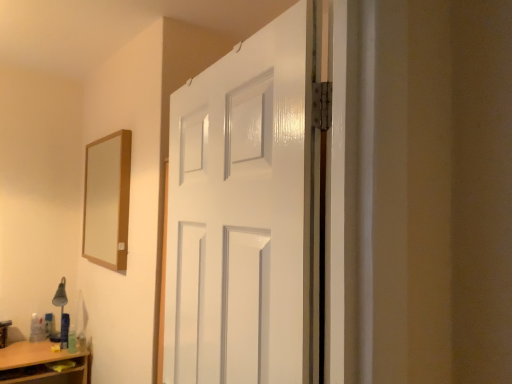
Question: Considering the positions of point (273, 163) and point (101, 256), is point (273, 163) closer or farther from the camera than point (101, 256)?

Choices:
 (A) closer
 (B) farther

Answer: (A)

Question: Which is correct: white glossy door at center is inside wooden-framed mirror at upper left, or outside of it?

Choices:
 (A) inside
 (B) outside

Answer: (B)

Question: Estimate the real-world distances between objects in this image. Which object is farther from the white glossy door at center?

Choices:
 (A) matte silver table lamp at lower left
 (B) wooden-framed mirror at upper left

Answer: (A)

Question: Which of these objects is positioned closest to the white glossy door at center?

Choices:
 (A) wooden-framed mirror at upper left
 (B) matte silver table lamp at lower left

Answer: (A)